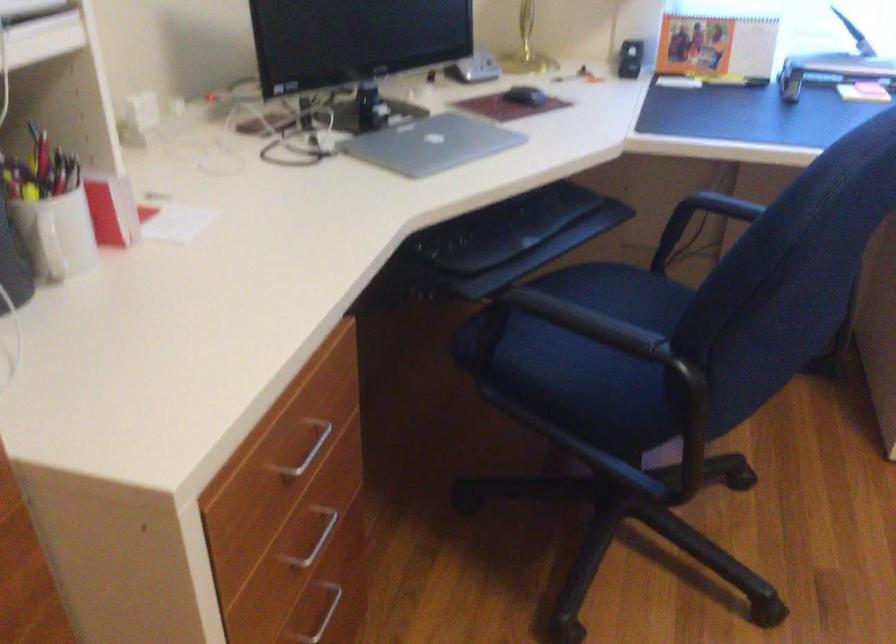
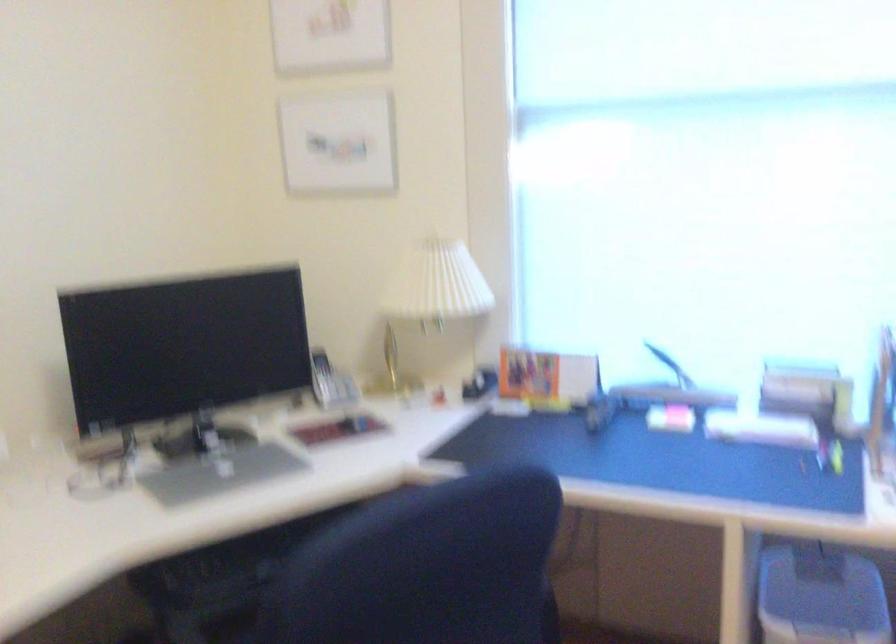
Question: What movement of the cameraman would produce the second image?

Choices:
 (A) Left
 (B) Right
 (C) Forward
 (D) Backward

Answer: (B)